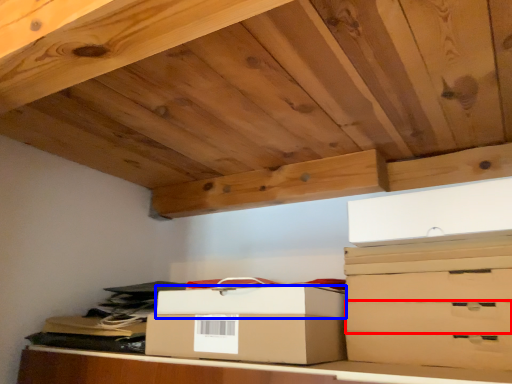
Question: Which object appears closest to the camera in this image, drawer (highlighted by a red box) or box (highlighted by a blue box)?

Choices:
 (A) drawer
 (B) box

Answer: (A)